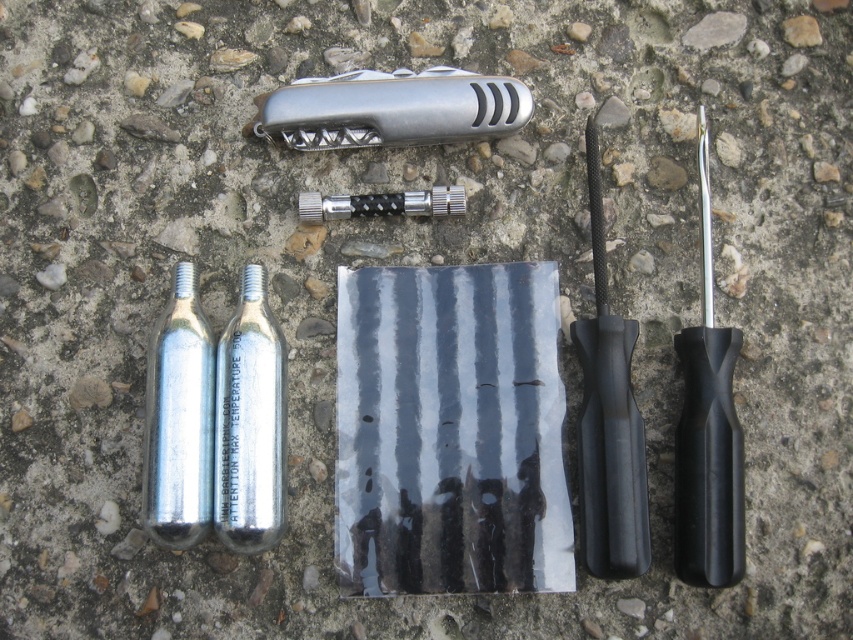
Between point (682, 364) and point (514, 109), which one is positioned in front?

Point (682, 364) is more forward.

Does black plastic razor at right have a lesser width compared to silver metallic pocketknife at center?

Yes, black plastic razor at right is thinner than silver metallic pocketknife at center.

Is point (717, 499) in front of point (491, 100)?

Yes, it is.

Find the location of `black plastic razor at right`. black plastic razor at right is located at coordinates (708, 433).

Is black textured razor at right further to the viewer compared to silver metallic cylinder at center?

No, black textured razor at right is closer to the viewer.

Who is lower down, black textured razor at right or silver metallic cylinder at center?

silver metallic cylinder at center is lower down.

Between point (616, 410) and point (270, 544), which one is positioned in front?

Positioned in front is point (616, 410).

At what (x,y) coordinates should I click in order to perform the action: click on black textured razor at right. Please return your answer as a coordinate pair (x, y). This screenshot has width=853, height=640. Looking at the image, I should click on (608, 419).

Which of these two, silver metallic cylinder at center or silver metallic cylinder at center-left, stands taller?

silver metallic cylinder at center is taller.

Does silver metallic cylinder at center appear on the right side of silver metallic cylinder at center-left?

Yes, silver metallic cylinder at center is to the right of silver metallic cylinder at center-left.

Between point (258, 528) and point (161, 515), which one is positioned in front?

Positioned in front is point (161, 515).

Image resolution: width=853 pixels, height=640 pixels. Identify the location of silver metallic cylinder at center. (248, 422).